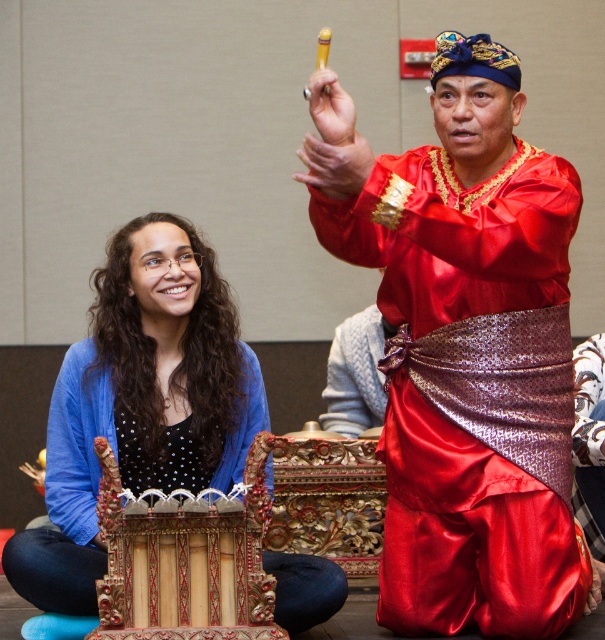
Based on the photo, does shiny red fabric at center appear on the right side of wooden instrument at lower left?

Indeed, shiny red fabric at center is positioned on the right side of wooden instrument at lower left.

Is point (574, 188) in front of point (157, 321)?

Yes, point (574, 188) is in front of point (157, 321).

This screenshot has height=640, width=605. Find the location of `shiny red fabric at center`. shiny red fabric at center is located at coordinates (465, 348).